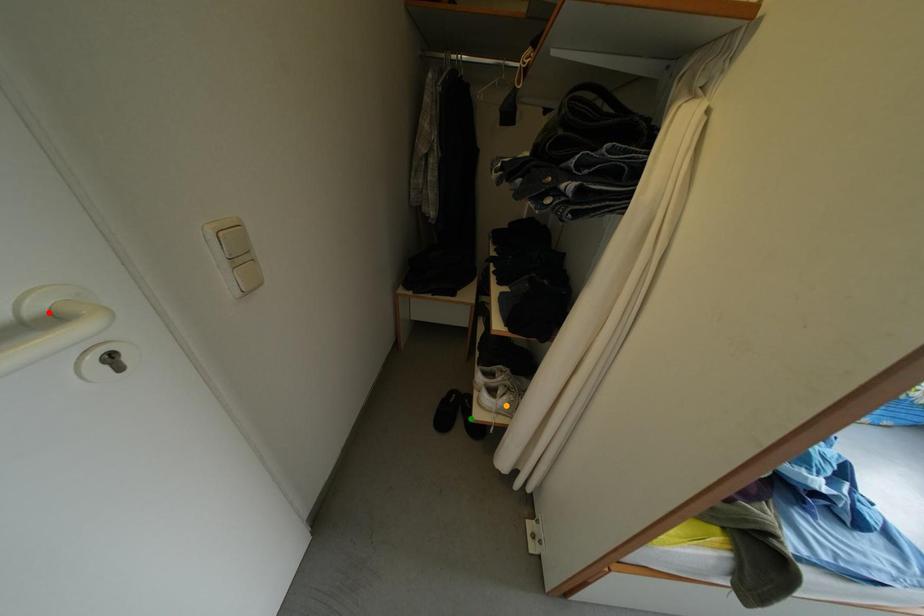
Order these from farthest to nearest:
red point
orange point
green point

green point < orange point < red point